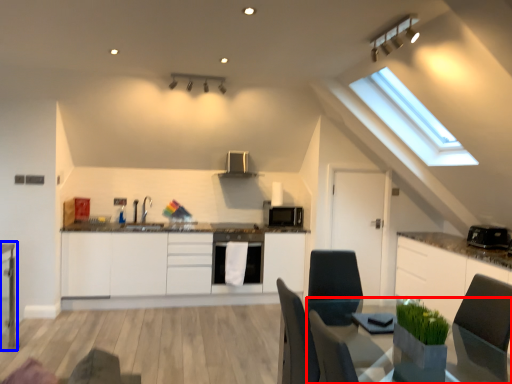
Question: Which object appears closest to the camera in this image, table (highlighted by a red box) or table (highlighted by a blue box)?

Choices:
 (A) table
 (B) table

Answer: (A)